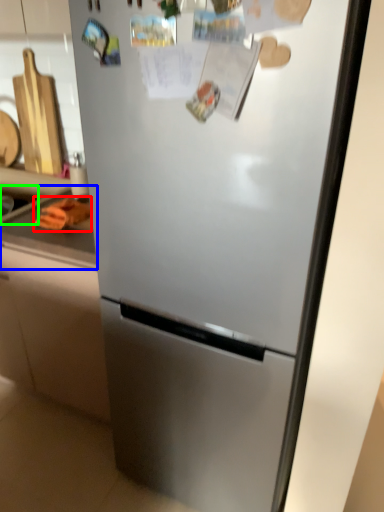
Question: Based on their relative distances, which object is nearer to food (highlighted by a red box)? Choose from counter top (highlighted by a blue box) and sink (highlighted by a green box).

Choices:
 (A) counter top
 (B) sink

Answer: (A)